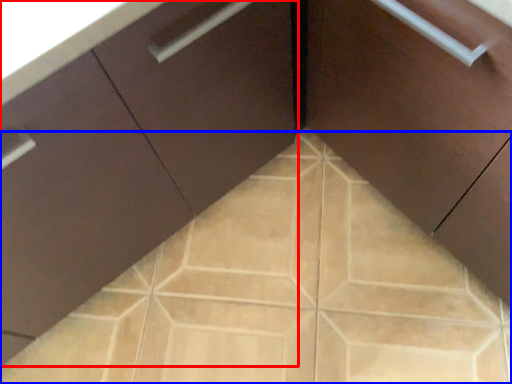
Question: Among these objects, which one is farthest to the camera, cabinetry (highlighted by a red box) or ceramic tile (highlighted by a blue box)?

Choices:
 (A) cabinetry
 (B) ceramic tile

Answer: (B)